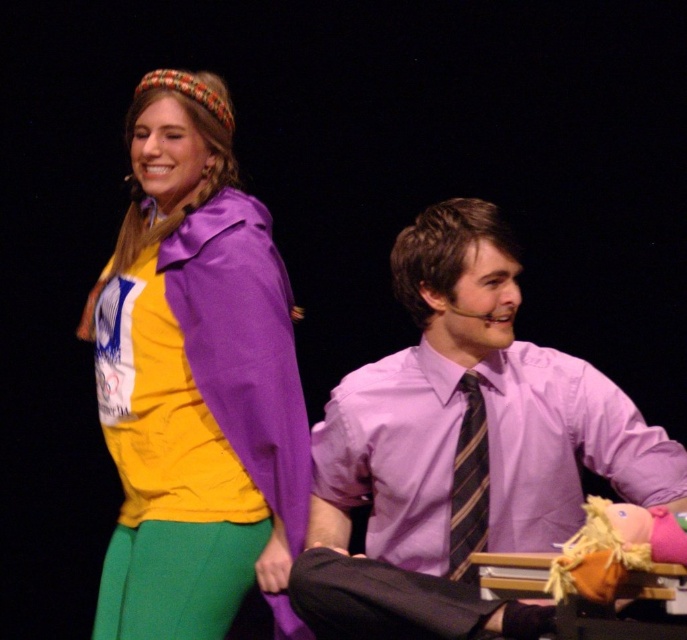
You are designing a stage backdrop and need to ensure the purple smooth shirt at center and the matte purple jacket at upper left are visible. Given their sizes, which object should be placed closer to the front to avoid being overshadowed?

The purple smooth shirt at center should be placed closer to the front since it has a larger size compared to the matte purple jacket at upper left, ensuring it remains visible.

You are an audience member sitting in the front row of the stage. You notice two points marked on the stage floor at coordinates point [495,477] and point [471,477]. If you were to walk straight towards the back of the stage, which point would you reach first?

Since point [471,477] is in front of point [495,477], you would reach point [471,477] first when walking towards the back of the stage.

You are designing a costume for a play and need to ensure that the purple smooth shirt at center and the striped fabric tie at center can be worn together. Based on their sizes, will the tie fit properly around the shirt?

The purple smooth shirt at center is bigger than the striped fabric tie at center, so the tie will fit properly around the shirt since it is smaller and designed to be worn with larger garments.